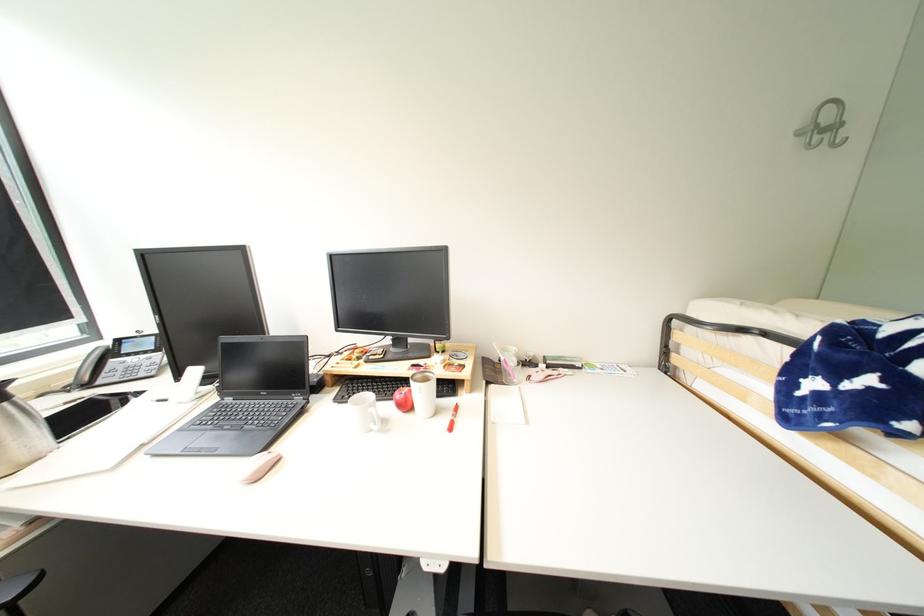
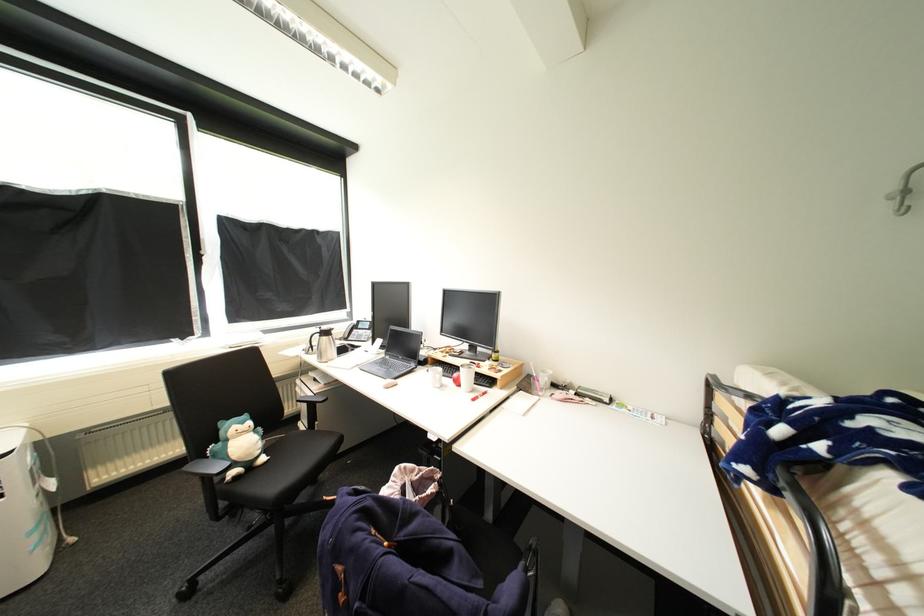
The point at [136,355] is marked in the first image. Where is the corresponding point in the second image?

(367, 330)